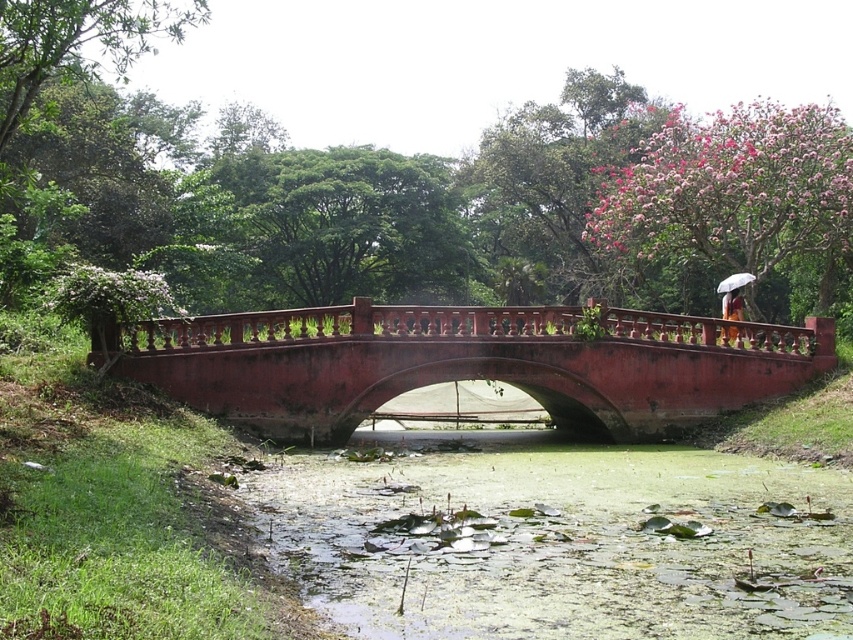
Question: Can you confirm if smooth red bridge at center is wider than white matte umbrella at upper right?

Choices:
 (A) yes
 (B) no

Answer: (A)

Question: Does green algae-covered water at center have a lesser width compared to white matte umbrella at upper right?

Choices:
 (A) no
 (B) yes

Answer: (A)

Question: Which point is closer to the camera taking this photo?

Choices:
 (A) (677, 396)
 (B) (596, 584)

Answer: (B)

Question: Which point appears farthest from the camera in this image?

Choices:
 (A) (354, 381)
 (B) (503, 545)

Answer: (A)

Question: Which object is farther from the camera taking this photo?

Choices:
 (A) white matte umbrella at upper right
 (B) green algae-covered water at center
 (C) smooth red bridge at center

Answer: (A)

Question: Is green algae-covered water at center further to camera compared to white matte umbrella at upper right?

Choices:
 (A) no
 (B) yes

Answer: (A)